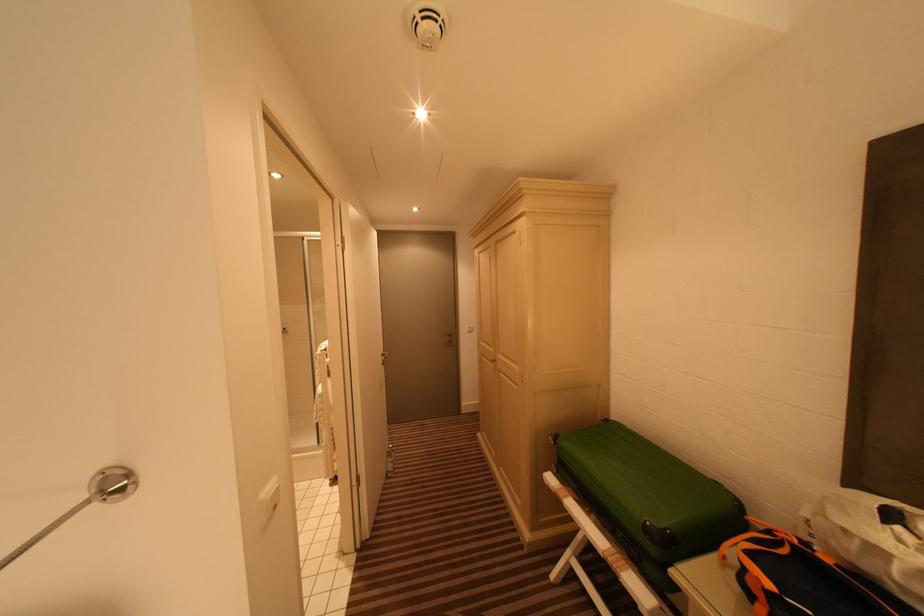
This screenshot has width=924, height=616. Find the location of `red light switch`. red light switch is located at coordinates (268, 501).